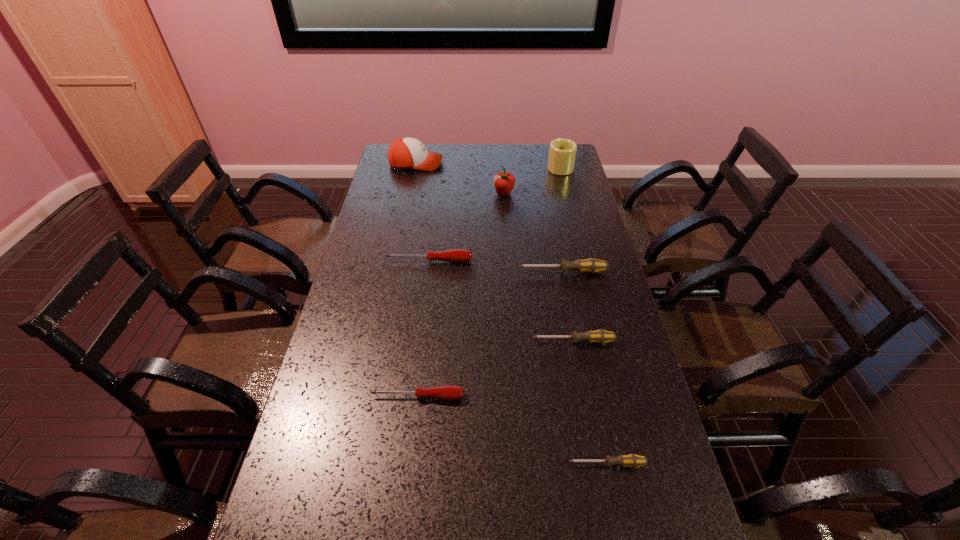
At what (x,y) coordinates should I click in order to perform the action: click on the seventh farthest object. Please return your answer as a coordinate pair (x, y). This screenshot has width=960, height=540. Looking at the image, I should click on (447, 392).

Where is `the smaller red screwdriver`? The width and height of the screenshot is (960, 540). the smaller red screwdriver is located at coordinates (447, 392).

Image resolution: width=960 pixels, height=540 pixels. In order to click on the nearest screwdriver in this screenshot , I will do `click(631, 460)`.

Locate an element on the screen. Image resolution: width=960 pixels, height=540 pixels. the shortest screwdriver is located at coordinates (631, 460).

This screenshot has height=540, width=960. Find the location of `blank area located 0.230m on the front-facing side of the orange baseball cap`. blank area located 0.230m on the front-facing side of the orange baseball cap is located at coordinates (494, 164).

Where is `blank area located with the handle on the side of the mug`? blank area located with the handle on the side of the mug is located at coordinates (556, 152).

Image resolution: width=960 pixels, height=540 pixels. I want to click on vacant point located with the handle on the side of the mug, so [x=554, y=146].

Where is `free space located with the handle on the side of the mug`? free space located with the handle on the side of the mug is located at coordinates (555, 146).

This screenshot has width=960, height=540. Find the location of `free space located on the left of the red apple`. free space located on the left of the red apple is located at coordinates (422, 193).

At what (x,y) coordinates should I click in order to perform the action: click on free space located at the tip of the farthest gray screwdriver. Please return your answer as a coordinate pair (x, y). This screenshot has height=540, width=960. Looking at the image, I should click on (441, 272).